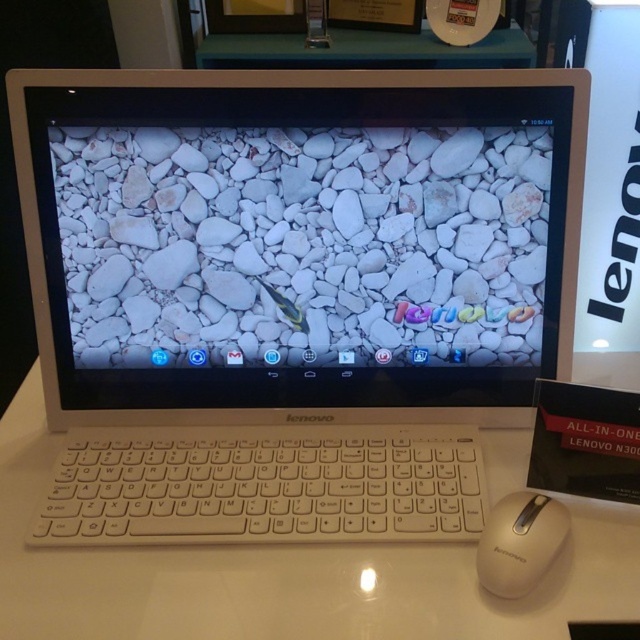
Does white matte laptop at center lie behind white glossy table at center?

Yes, it is behind white glossy table at center.

Based on the photo, which is more to the left, white matte laptop at center or white glossy table at center?

Positioned to the left is white glossy table at center.

The image size is (640, 640). I want to click on white matte laptop at center, so click(291, 292).

The image size is (640, 640). Find the location of `white matte laptop at center`. white matte laptop at center is located at coordinates (291, 292).

Is white plastic keyboard at center to the left of white matte mouse at lower right from the viewer's perspective?

Indeed, white plastic keyboard at center is positioned on the left side of white matte mouse at lower right.

Is white plastic keyboard at center closer to camera compared to white matte mouse at lower right?

No.

Who is more forward, (x=45, y=508) or (x=540, y=544)?

Positioned in front is point (x=540, y=544).

Image resolution: width=640 pixels, height=640 pixels. Find the location of `white plastic keyboard at center`. white plastic keyboard at center is located at coordinates (264, 484).

Who is more distant from viewer, (26,163) or (285,516)?

Positioned behind is point (26,163).

This screenshot has height=640, width=640. Identify the location of white matte laptop at center. (291, 292).